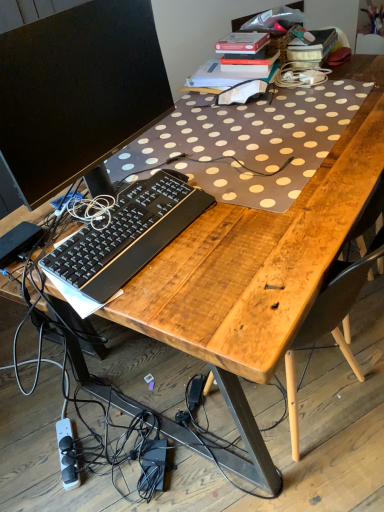
Question: Can you confirm if black plastic keyboard at center is wider than black matte computer monitor at upper left?

Choices:
 (A) no
 (B) yes

Answer: (B)

Question: From a real-world perspective, is black plastic keyboard at center on black matte computer monitor at upper left?

Choices:
 (A) yes
 (B) no

Answer: (B)

Question: Does black plastic keyboard at center appear on the right side of black matte computer monitor at upper left?

Choices:
 (A) yes
 (B) no

Answer: (A)

Question: Is black plastic keyboard at center smaller than black matte computer monitor at upper left?

Choices:
 (A) no
 (B) yes

Answer: (B)

Question: Can you confirm if black plastic keyboard at center is bigger than black matte computer monitor at upper left?

Choices:
 (A) no
 (B) yes

Answer: (A)

Question: Considering the positions of black matte computer monitor at upper left and black plastic keyboard at center in the image, is black matte computer monitor at upper left bigger or smaller than black plastic keyboard at center?

Choices:
 (A) small
 (B) big

Answer: (B)

Question: Is black matte computer monitor at upper left situated inside black plastic keyboard at center or outside?

Choices:
 (A) outside
 (B) inside

Answer: (A)

Question: Is black matte computer monitor at upper left wider or thinner than black plastic keyboard at center?

Choices:
 (A) thin
 (B) wide

Answer: (A)

Question: Does point (148, 101) appear closer or farther from the camera than point (72, 269)?

Choices:
 (A) farther
 (B) closer

Answer: (A)

Question: In terms of width, does black plastic keyboard at center look wider or thinner when compared to white plastic power strip at lower left?

Choices:
 (A) wide
 (B) thin

Answer: (B)

Question: In terms of height, does black plastic keyboard at center look taller or shorter compared to white plastic power strip at lower left?

Choices:
 (A) short
 (B) tall

Answer: (B)

Question: From the image's perspective, is black plastic keyboard at center located above or below white plastic power strip at lower left?

Choices:
 (A) below
 (B) above

Answer: (B)

Question: Which is correct: black plastic keyboard at center is inside white plastic power strip at lower left, or outside of it?

Choices:
 (A) inside
 (B) outside

Answer: (B)

Question: Considering the positions of point (57, 439) and point (77, 82), is point (57, 439) closer or farther from the camera than point (77, 82)?

Choices:
 (A) closer
 (B) farther

Answer: (B)

Question: Is white plastic power strip at lower left to the left or to the right of black matte computer monitor at upper left in the image?

Choices:
 (A) right
 (B) left

Answer: (B)